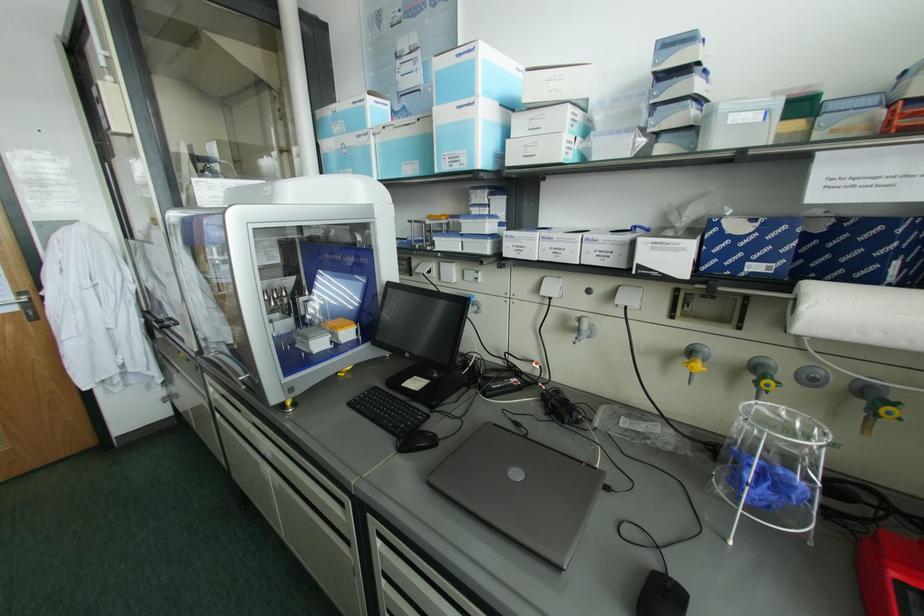
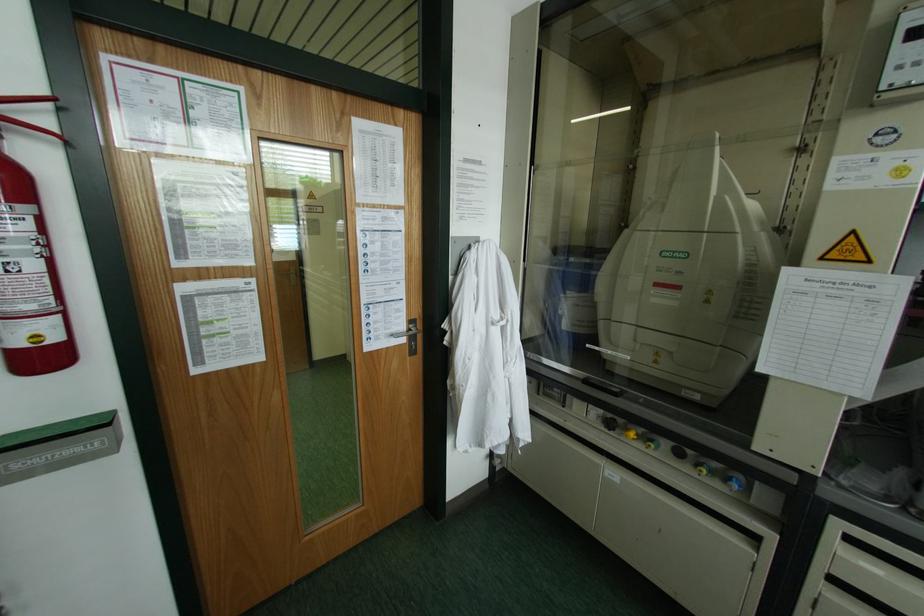
Question: What movement of the cameraman would produce the second image?

Choices:
 (A) Left
 (B) Right
 (C) Forward
 (D) Backward

Answer: (A)